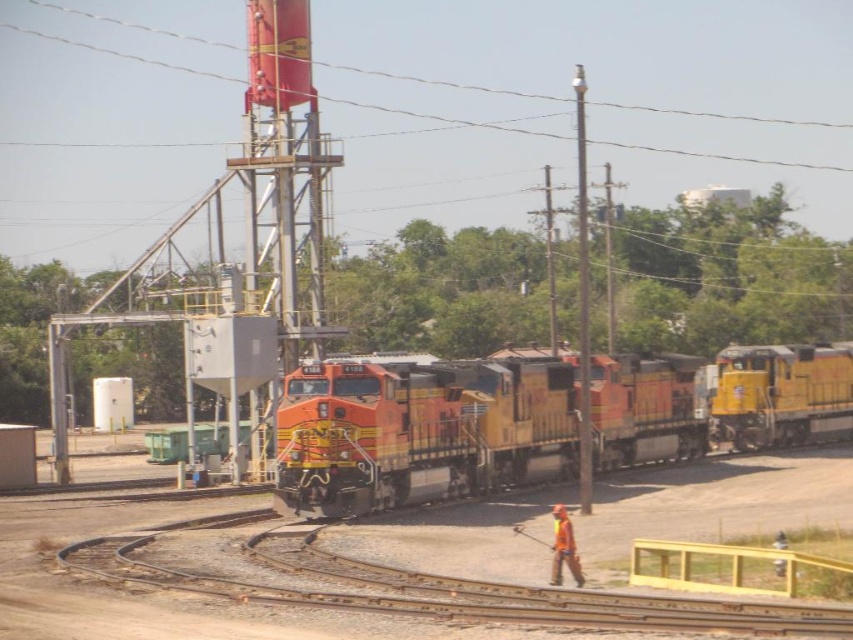
Question: Does orange/yellow locomotive at center appear on the right side of orange hard hat at lower right?

Choices:
 (A) no
 (B) yes

Answer: (A)

Question: Estimate the real-world distances between objects in this image. Which object is closer to the orange hard hat at lower right?

Choices:
 (A) orange fabric safety vest at lower center
 (B) metallic wire at upper center

Answer: (A)

Question: Is orange hard hat at lower right above orange fabric safety vest at lower center?

Choices:
 (A) yes
 (B) no

Answer: (B)

Question: Considering the real-world distances, which object is farthest from the orange fabric safety vest at lower center?

Choices:
 (A) smooth steel train track at lower center
 (B) orange/yellow locomotive at center
 (C) orange hard hat at lower right

Answer: (B)

Question: Which point is farther to the camera?

Choices:
 (A) metallic wire at upper center
 (B) orange fabric safety vest at lower center
 (C) orange hard hat at lower right
 (D) smooth steel train track at lower center

Answer: (A)

Question: Does orange hard hat at lower right have a greater width compared to orange fabric safety vest at lower center?

Choices:
 (A) no
 (B) yes

Answer: (B)